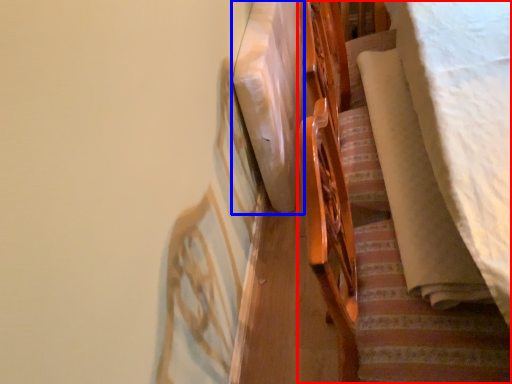
Question: Among these objects, which one is farthest to the camera, furniture (highlighted by a red box) or linen (highlighted by a blue box)?

Choices:
 (A) furniture
 (B) linen

Answer: (B)